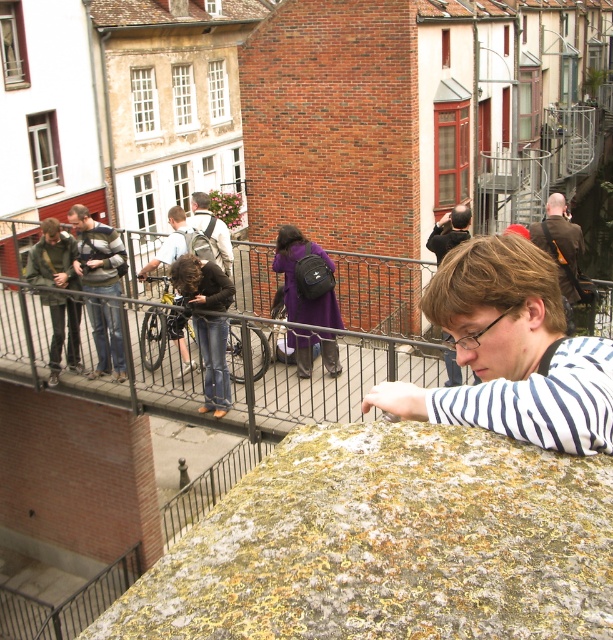
Question: Which point is closer to the camera?

Choices:
 (A) dark blue jeans at center
 (B) dark purple fabric coat at center
 (C) dark brown leather jacket at upper right

Answer: (A)

Question: Which point is farther from the camera taking this photo?

Choices:
 (A) (88, 305)
 (B) (39, 257)

Answer: (A)

Question: Is matte black backpack at left to the left of matte black jacket at center from the viewer's perspective?

Choices:
 (A) no
 (B) yes

Answer: (B)

Question: Which point is closer to the camera taking this photo?

Choices:
 (A) (80, 241)
 (B) (44, 298)

Answer: (B)

Question: Does striped fabric at center have a greater width compared to denim jeans at center?

Choices:
 (A) no
 (B) yes

Answer: (B)

Question: Does mossy stone at center have a lesser width compared to dark purple fabric coat at center?

Choices:
 (A) yes
 (B) no

Answer: (B)